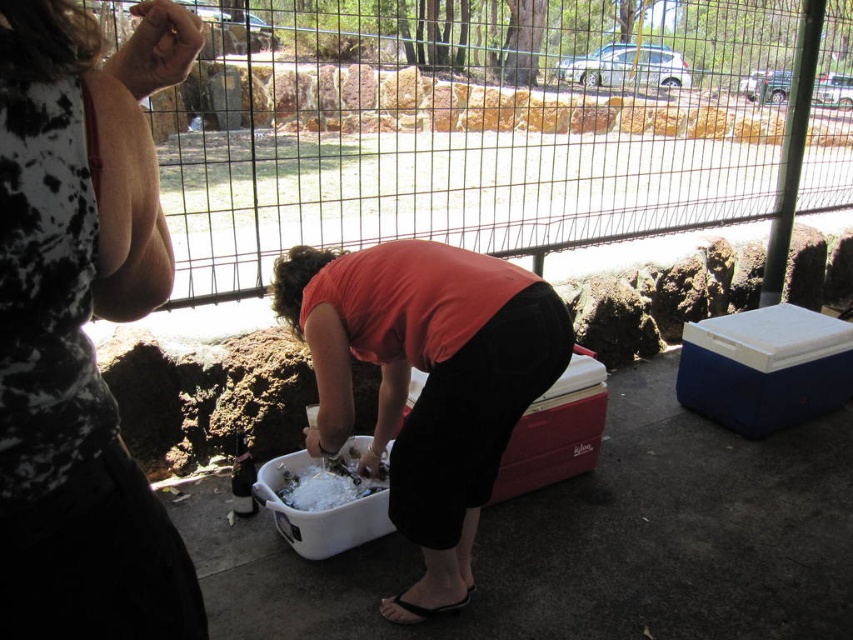
You are setting up for a picnic and have two white plastic buckets. The white plastic bucket at center and the white plastic bucket at lower center are both needed for the setup. Based on their positions, which bucket should you place first to ensure stability?

The white plastic bucket at lower center should be placed first because the white plastic bucket at center is positioned over it, so placing the lower one first ensures stability.

You are standing 5 feet away from the white plastic bucket at center. Can you reach it without moving your feet?

The white plastic bucket at center is 5.10 feet away from you, so you cannot reach it without moving your feet since it is slightly farther than 5 feet.